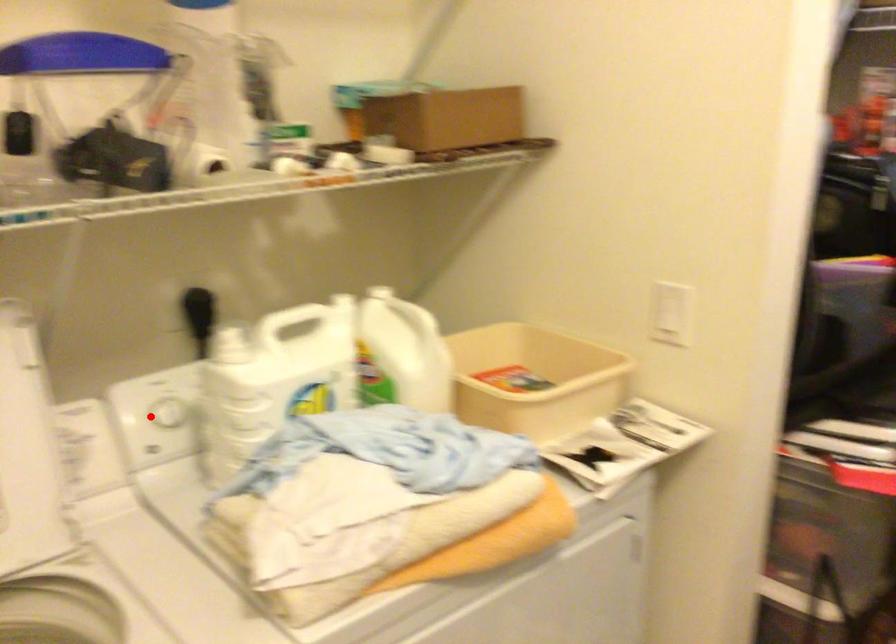
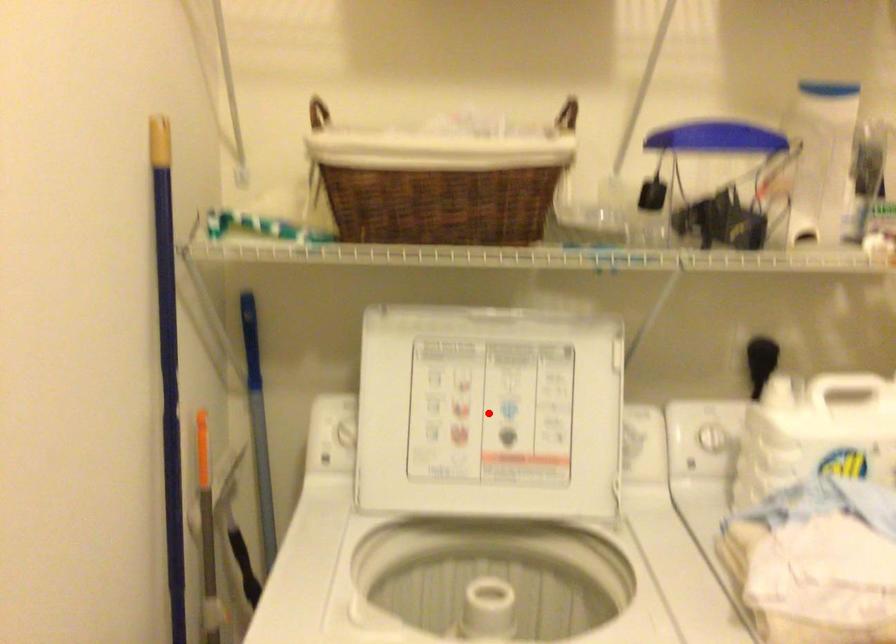
I am providing you with two images of the same scene from different viewpoints. A red point is marked on the first image and another point is marked on the second image. Is the red point in image1 aligned with the point shown in image2?

No